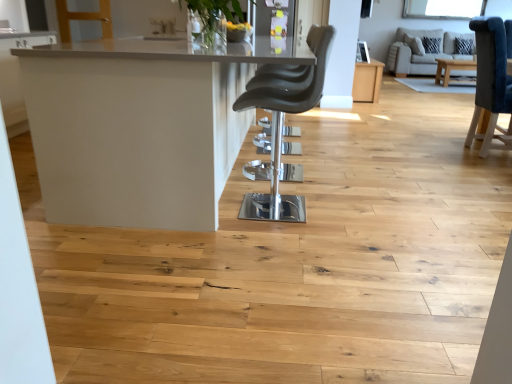
Question: Is white glossy table at center, which is the second table from back to front, located outside matte black chair at center?

Choices:
 (A) no
 (B) yes

Answer: (B)

Question: Is white glossy table at center, which ranks as the 1th table in left-to-right order, positioned with its back to matte black chair at center?

Choices:
 (A) no
 (B) yes

Answer: (A)

Question: Is white glossy table at center, which is the second table from right to left, closer to the viewer compared to matte black chair at center?

Choices:
 (A) yes
 (B) no

Answer: (A)

Question: Does white glossy table at center, which is the second table from back to front, lie behind matte black chair at center?

Choices:
 (A) no
 (B) yes

Answer: (A)

Question: Is white glossy table at center, the 1th table in the bottom-to-top sequence, taller than matte black chair at center?

Choices:
 (A) no
 (B) yes

Answer: (A)

Question: Is beige fabric couch at upper right in front of or behind matte black chair at center in the image?

Choices:
 (A) behind
 (B) front

Answer: (A)

Question: In the image, is beige fabric couch at upper right on the left side or the right side of matte black chair at center?

Choices:
 (A) right
 (B) left

Answer: (A)

Question: From the image's perspective, is beige fabric couch at upper right above or below matte black chair at center?

Choices:
 (A) above
 (B) below

Answer: (A)

Question: Does point (443, 36) appear closer or farther from the camera than point (309, 89)?

Choices:
 (A) closer
 (B) farther

Answer: (B)

Question: Is point (275, 183) positioned closer to the camera than point (394, 51)?

Choices:
 (A) closer
 (B) farther

Answer: (A)

Question: From the image's perspective, is matte black chair at center located above or below beige fabric couch at upper right?

Choices:
 (A) below
 (B) above

Answer: (A)

Question: Based on their positions, is matte black chair at center located to the left or right of beige fabric couch at upper right?

Choices:
 (A) left
 (B) right

Answer: (A)

Question: Looking at their shapes, would you say matte black chair at center is wider or thinner than beige fabric couch at upper right?

Choices:
 (A) wide
 (B) thin

Answer: (B)

Question: In terms of size, does white glossy table at center, positioned as the 1th table in front-to-back order, appear bigger or smaller than beige fabric couch at upper right?

Choices:
 (A) small
 (B) big

Answer: (B)

Question: Considering the positions of point (147, 198) and point (441, 38), is point (147, 198) closer or farther from the camera than point (441, 38)?

Choices:
 (A) farther
 (B) closer

Answer: (B)